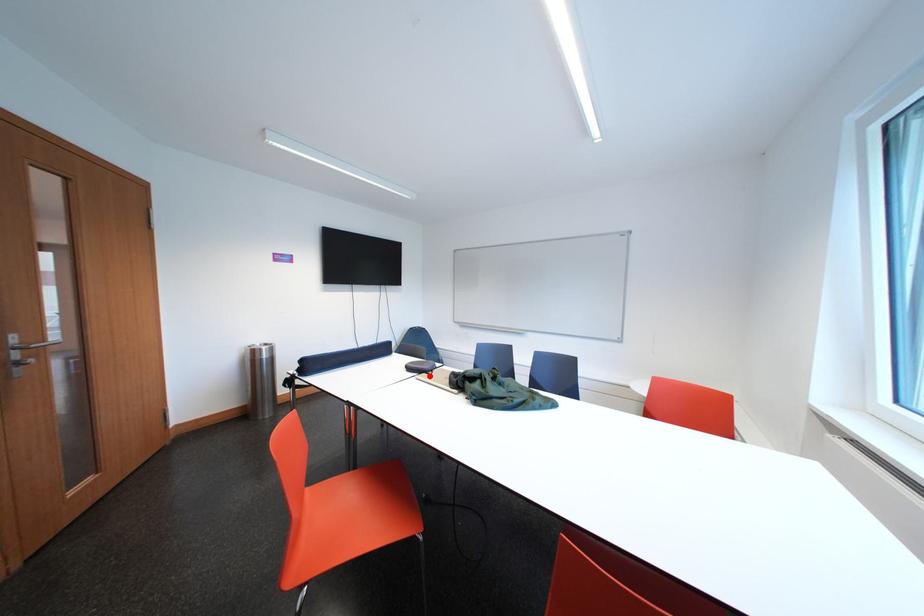
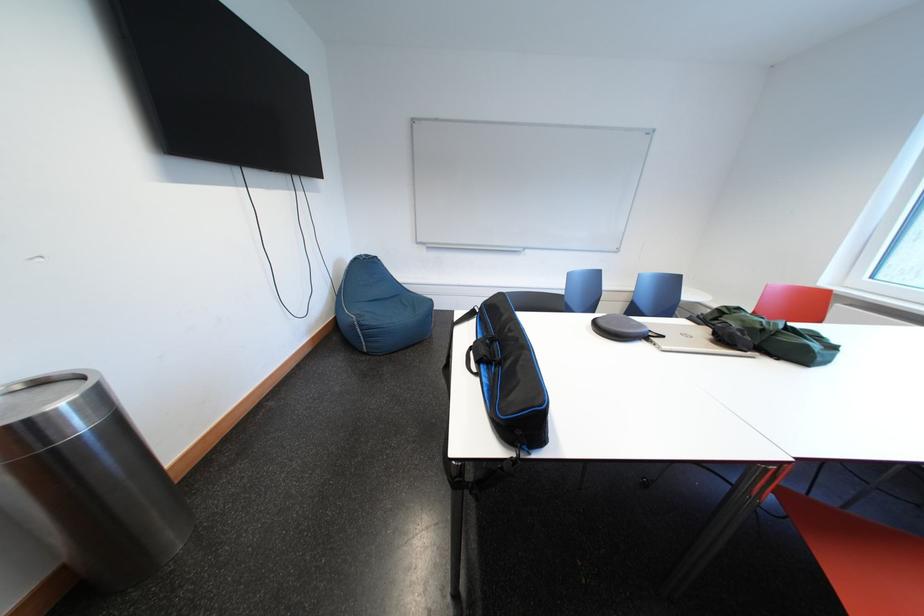
In the second image, find the point that corresponds to the highlighted location in the first image.

(657, 341)